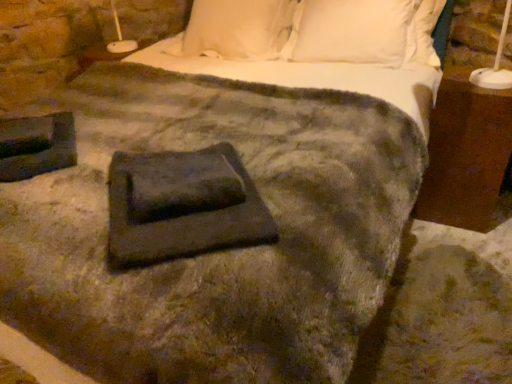
The height and width of the screenshot is (384, 512). Describe the element at coordinates (467, 155) in the screenshot. I see `brown wood nightstand at right` at that location.

The image size is (512, 384). What are the coordinates of `brown wood nightstand at right` in the screenshot? It's located at (467, 155).

What is the approximate width of brown wood nightstand at right?

brown wood nightstand at right is 13.26 inches in width.

Describe the element at coordinates (182, 206) in the screenshot. I see `dark gray fabric at center` at that location.

Measure the distance between dark gray fabric at center and camera.

dark gray fabric at center and camera are 35.05 inches apart from each other.

Where is `dark gray fabric at center`? The width and height of the screenshot is (512, 384). dark gray fabric at center is located at coordinates (182, 206).

At what (x,y) coordinates should I click in order to perform the action: click on brown wood nightstand at right. Please return your answer as a coordinate pair (x, y). Looking at the image, I should click on (467, 155).

Which object is positioned more to the right, dark gray fabric at center or brown wood nightstand at right?

brown wood nightstand at right.

Does dark gray fabric at center lie behind brown wood nightstand at right?

No, dark gray fabric at center is closer to the viewer.

Between point (155, 162) and point (474, 132), which one is positioned in front?

The point (155, 162) is more forward.

From the image's perspective, is dark gray fabric at center located beneath brown wood nightstand at right?

Correct, dark gray fabric at center appears lower than brown wood nightstand at right in the image.

From a real-world perspective, is dark gray fabric at center above or below brown wood nightstand at right?

In terms of real-world spatial position, dark gray fabric at center is above brown wood nightstand at right.

Which of these two, dark gray fabric at center or brown wood nightstand at right, is thinner?

brown wood nightstand at right.

Can you confirm if dark gray fabric at center is shorter than brown wood nightstand at right?

Yes, dark gray fabric at center is shorter than brown wood nightstand at right.

Who is smaller, dark gray fabric at center or brown wood nightstand at right?

Smaller between the two is dark gray fabric at center.

Could brown wood nightstand at right be considered to be inside dark gray fabric at center?

No, dark gray fabric at center does not contain brown wood nightstand at right.

Are dark gray fabric at center and brown wood nightstand at right making contact?

No.

Is dark gray fabric at center looking in the opposite direction of brown wood nightstand at right?

No.

What's the angular difference between dark gray fabric at center and brown wood nightstand at right's facing directions?

dark gray fabric at center and brown wood nightstand at right are facing 41.8 degrees away from each other.

The image size is (512, 384). What are the coordinates of `slate that appears on the left of brown wood nightstand at right` in the screenshot? It's located at pos(182,206).

Based on their positions, is brown wood nightstand at right located to the left or right of dark gray fabric at center?

Based on their positions, brown wood nightstand at right is located to the right of dark gray fabric at center.

Is brown wood nightstand at right further to the viewer compared to dark gray fabric at center?

Yes, brown wood nightstand at right is further from the camera.

Is point (429, 180) positioned after point (115, 237)?

That is True.

From the image's perspective, between brown wood nightstand at right and dark gray fabric at center, who is located below?

dark gray fabric at center, from the image's perspective.

From a real-world perspective, does brown wood nightstand at right stand above dark gray fabric at center?

Incorrect, from a real-world perspective, brown wood nightstand at right is lower than dark gray fabric at center.

Considering the sizes of objects brown wood nightstand at right and dark gray fabric at center in the image provided, who is wider, brown wood nightstand at right or dark gray fabric at center?

With larger width is dark gray fabric at center.

Which of these two, brown wood nightstand at right or dark gray fabric at center, stands shorter?

Standing shorter between the two is dark gray fabric at center.

Does brown wood nightstand at right have a smaller size compared to dark gray fabric at center?

Actually, brown wood nightstand at right might be larger than dark gray fabric at center.

Is brown wood nightstand at right not inside dark gray fabric at center?

Yes, brown wood nightstand at right is outside of dark gray fabric at center.

Is brown wood nightstand at right with dark gray fabric at center?

No.

Consider the image. Is dark gray fabric at center at the back of brown wood nightstand at right?

brown wood nightstand at right is not turned away from dark gray fabric at center.

I want to click on slate on the left of brown wood nightstand at right, so click(x=182, y=206).

Locate an element on the screen. This screenshot has width=512, height=384. slate in front of the brown wood nightstand at right is located at coordinates (182, 206).

Find the location of a particular element. This screenshot has height=384, width=512. slate above the brown wood nightstand at right (from a real-world perspective) is located at coordinates (182, 206).